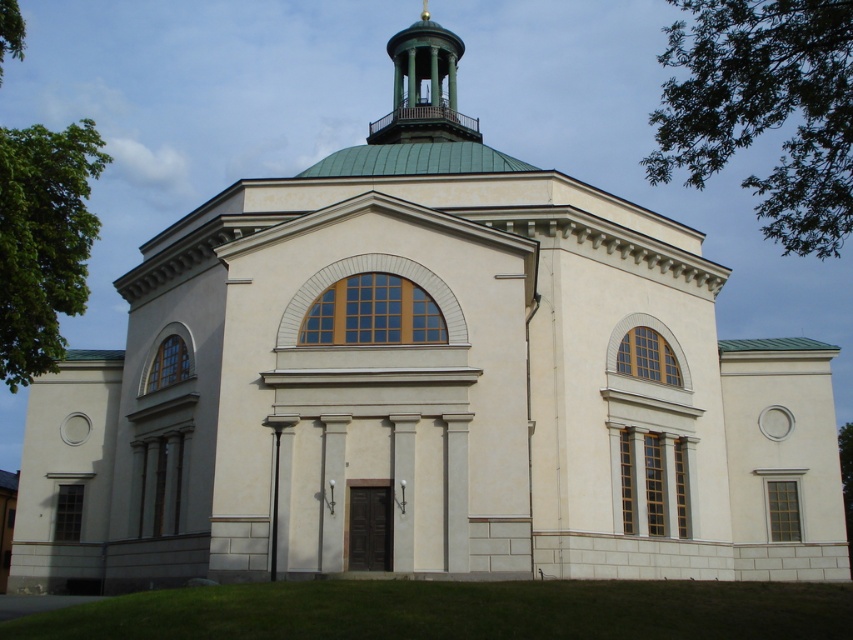
Does green leafy tree at left have a smaller size compared to green matte dome at upper center?

No, green leafy tree at left is not smaller than green matte dome at upper center.

Is the position of green leafy tree at left less distant than that of green matte dome at upper center?

Yes.

Where is `green leafy tree at left`? Image resolution: width=853 pixels, height=640 pixels. green leafy tree at left is located at coordinates (44, 241).

Where is `green leafy tree at left`? green leafy tree at left is located at coordinates (44, 241).

Can you confirm if green leafy tree at upper right is shorter than green leafy tree at left?

In fact, green leafy tree at upper right may be taller than green leafy tree at left.

Locate an element on the screen. green leafy tree at upper right is located at coordinates (764, 109).

Identify the location of green leafy tree at upper right. (764, 109).

What do you see at coordinates (764, 109) in the screenshot?
I see `green leafy tree at upper right` at bounding box center [764, 109].

Between point (805, 84) and point (396, 96), which one is positioned in front?

Point (805, 84)

What are the coordinates of `green leafy tree at upper right` in the screenshot? It's located at (764, 109).

Find the location of a particular element. The height and width of the screenshot is (640, 853). green leafy tree at upper right is located at coordinates (764, 109).